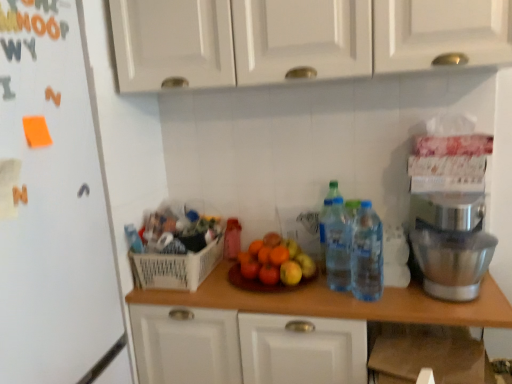
Question: Considering the relative sizes of translucent plastic bottles at center right and white plastic basket at center in the image provided, is translucent plastic bottles at center right taller than white plastic basket at center?

Choices:
 (A) no
 (B) yes

Answer: (B)

Question: Can you confirm if translucent plastic bottles at center right is bigger than white plastic basket at center?

Choices:
 (A) yes
 (B) no

Answer: (B)

Question: Is translucent plastic bottles at center right positioned with its back to white plastic basket at center?

Choices:
 (A) yes
 (B) no

Answer: (B)

Question: Is translucent plastic bottles at center right positioned before white plastic basket at center?

Choices:
 (A) no
 (B) yes

Answer: (B)

Question: Considering the relative positions of translucent plastic bottles at center right and white plastic basket at center in the image provided, is translucent plastic bottles at center right behind white plastic basket at center?

Choices:
 (A) yes
 (B) no

Answer: (B)

Question: Is white plastic basket at center in front of or behind silver metallic stand mixer at right in the image?

Choices:
 (A) behind
 (B) front

Answer: (A)

Question: Considering the positions of white plastic basket at center and silver metallic stand mixer at right in the image, is white plastic basket at center taller or shorter than silver metallic stand mixer at right?

Choices:
 (A) tall
 (B) short

Answer: (B)

Question: Is white plastic basket at center wider or thinner than silver metallic stand mixer at right?

Choices:
 (A) wide
 (B) thin

Answer: (A)

Question: From a real-world perspective, is white plastic basket at center positioned above or below silver metallic stand mixer at right?

Choices:
 (A) below
 (B) above

Answer: (A)

Question: Is translucent plastic bottles at center, acting as the 2th bottle starting from the left, situated inside translucent plastic water bottles at center-right, the third bottle positioned from the left, or outside?

Choices:
 (A) inside
 (B) outside

Answer: (B)

Question: In the image, is translucent plastic bottles at center, which appears as the 1th bottle when viewed from the front, on the left side or the right side of translucent plastic water bottles at center-right, the third bottle positioned from the left?

Choices:
 (A) left
 (B) right

Answer: (A)

Question: From the image's perspective, is translucent plastic bottles at center, acting as the 2th bottle starting from the right, positioned above or below translucent plastic water bottles at center-right, placed as the 2th bottle when sorted from back to front?

Choices:
 (A) above
 (B) below

Answer: (B)

Question: In terms of size, does translucent plastic bottles at center, acting as the 2th bottle starting from the right, appear bigger or smaller than translucent plastic water bottles at center-right, the second bottle viewed from the front?

Choices:
 (A) big
 (B) small

Answer: (A)

Question: From their relative heights in the image, would you say translucent plastic bottles at center right is taller or shorter than translucent plastic water bottles at center-right, the second bottle viewed from the front?

Choices:
 (A) short
 (B) tall

Answer: (A)

Question: Looking at the image, does translucent plastic bottles at center right seem bigger or smaller compared to translucent plastic water bottles at center-right, the third bottle positioned from the left?

Choices:
 (A) small
 (B) big

Answer: (B)